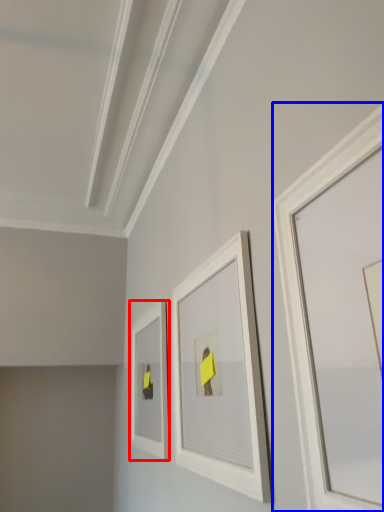
Question: Which object appears closest to the camera in this image, picture frame (highlighted by a red box) or picture frame (highlighted by a blue box)?

Choices:
 (A) picture frame
 (B) picture frame

Answer: (B)